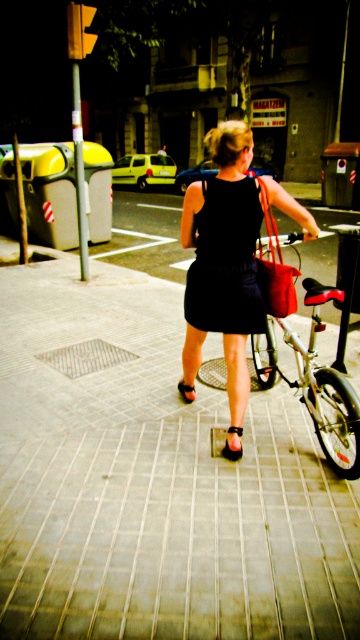
You are a delivery person who needs to place a package on the gray tile pavement at center. However, there is a black leather sandal at center in the way. Based on their positions, can you determine if the sandal is blocking the direct path to the pavement?

The gray tile pavement at center is to the left of the black leather sandal at center, so the sandal is blocking the direct path to the pavement.